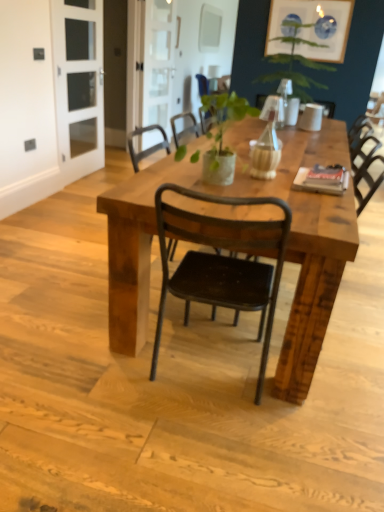
Question: From the image's perspective, is black metal chair at center, which ranks as the first chair in bottom-to-top order, on rustic wood table at center?

Choices:
 (A) no
 (B) yes

Answer: (A)

Question: Is black metal chair at center, which ranks as the first chair in bottom-to-top order, located outside rustic wood table at center?

Choices:
 (A) no
 (B) yes

Answer: (A)

Question: Is rustic wood table at center completely or partially inside black metal chair at center, which ranks as the first chair in bottom-to-top order?

Choices:
 (A) no
 (B) yes

Answer: (A)

Question: Is black metal chair at center, arranged as the first chair when viewed from the front, facing towards rustic wood table at center?

Choices:
 (A) no
 (B) yes

Answer: (B)

Question: From a real-world perspective, is black metal chair at center, which ranks as the first chair in bottom-to-top order, physically above rustic wood table at center?

Choices:
 (A) no
 (B) yes

Answer: (B)

Question: Is black metal chair at center, which is counted as the 2th chair, starting from the front, spatially inside clear glass screen door at upper center, which ranks as the 2th screen door in left-to-right order, or outside of it?

Choices:
 (A) outside
 (B) inside

Answer: (A)

Question: Based on their positions, is black metal chair at center, which is counted as the 2th chair, starting from the front, located to the left or right of clear glass screen door at upper center, the first screen door when ordered from right to left?

Choices:
 (A) right
 (B) left

Answer: (A)

Question: Is point [x=218, y=93] positioned closer to the camera than point [x=168, y=65]?

Choices:
 (A) closer
 (B) farther

Answer: (A)

Question: Is black metal chair at center, which is counted as the 2th chair, starting from the front, bigger or smaller than clear glass screen door at upper center, the first screen door when ordered from right to left?

Choices:
 (A) big
 (B) small

Answer: (A)

Question: Based on their sizes in the image, would you say green matte plant at center is bigger or smaller than black metal chair at center, the 2th chair positioned from the top?

Choices:
 (A) big
 (B) small

Answer: (B)

Question: Does point (182, 155) appear closer or farther from the camera than point (228, 220)?

Choices:
 (A) closer
 (B) farther

Answer: (B)

Question: Is green matte plant at center wider or thinner than black metal chair at center, the second chair when ordered from back to front?

Choices:
 (A) thin
 (B) wide

Answer: (A)

Question: In terms of height, does green matte plant at center look taller or shorter compared to black metal chair at center, the second chair when ordered from back to front?

Choices:
 (A) tall
 (B) short

Answer: (B)

Question: Choose the correct answer: Is black metal chair at center, the 2th chair positioned from the top, inside black metal chair at center, the 2th chair positioned from the bottom, or outside it?

Choices:
 (A) inside
 (B) outside

Answer: (B)

Question: Considering the positions of black metal chair at center, arranged as the first chair when viewed from the front, and black metal chair at center, the 2th chair positioned from the bottom, in the image, is black metal chair at center, arranged as the first chair when viewed from the front, wider or thinner than black metal chair at center, the 2th chair positioned from the bottom,?

Choices:
 (A) wide
 (B) thin

Answer: (B)